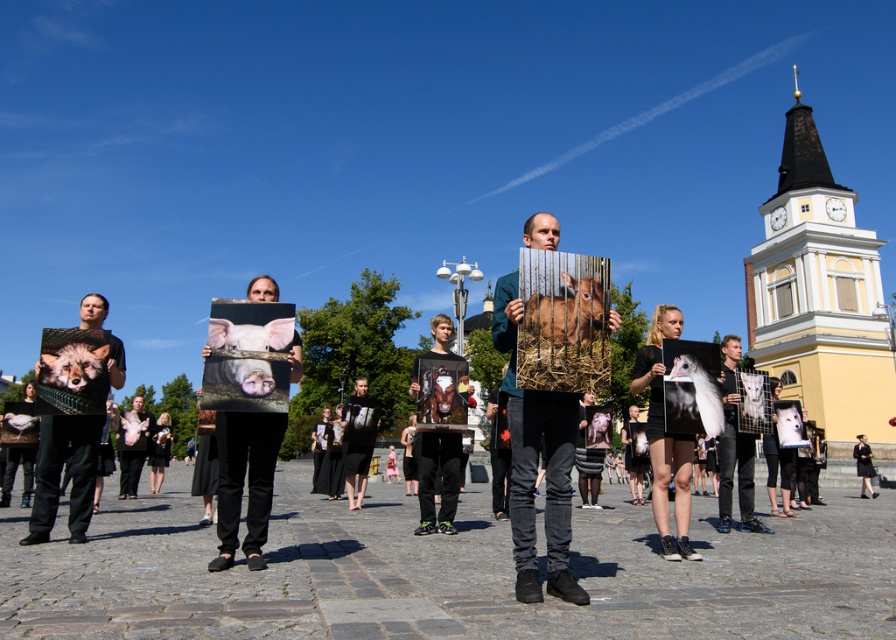
Is matte black dress at center smaller than black fabric dress at center?

No, matte black dress at center is not smaller than black fabric dress at center.

Between matte black dress at center and black fabric dress at center, which one is positioned lower?

black fabric dress at center

Between point (651, 490) and point (871, 456), which one is positioned in front?

Point (651, 490) is in front.

This screenshot has width=896, height=640. I want to click on matte black dress at center, so [665, 438].

Is matte black pig at center to the right of matte black dress at center from the viewer's perspective?

No, matte black pig at center is not to the right of matte black dress at center.

Can you confirm if matte black pig at center is bigger than matte black dress at center?

No, matte black pig at center is not bigger than matte black dress at center.

Is point (252, 545) positioned before point (673, 456)?

Yes, it is.

At what (x,y) coordinates should I click in order to perform the action: click on matte black pig at center. Please return your answer as a coordinate pair (x, y). Image resolution: width=896 pixels, height=640 pixels. Looking at the image, I should click on (247, 481).

Is matte black pig at center taller than black fabric dress at center?

Indeed, matte black pig at center has a greater height compared to black fabric dress at center.

Is point (271, 412) less distant than point (872, 492)?

Yes, point (271, 412) is closer to viewer.

Where is `matte black pig at center`? matte black pig at center is located at coordinates (247, 481).